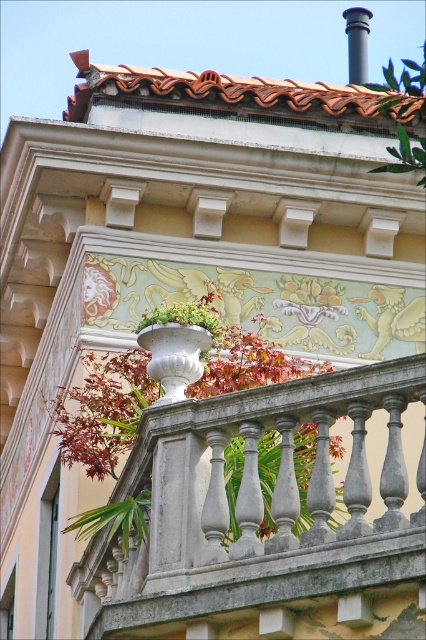
You are standing at the base of the building and see the green leafy plant at upper right. If you want to take a photo of it with your camera, which is 142.89 feet away from the plant, will you need a telephoto lens to capture it clearly?

The green leafy plant at upper right and camera are 142.89 feet apart, so yes, you will need a telephoto lens to capture it clearly from that distance.

You are standing in front of the building and notice two points marked on the facade. One is at coordinate point (104, 401) and the other at point (169, 333). Which point is closer to you?

Point (104, 401) is further to the viewer than point (169, 333), so the point at (169, 333) is closer to you.